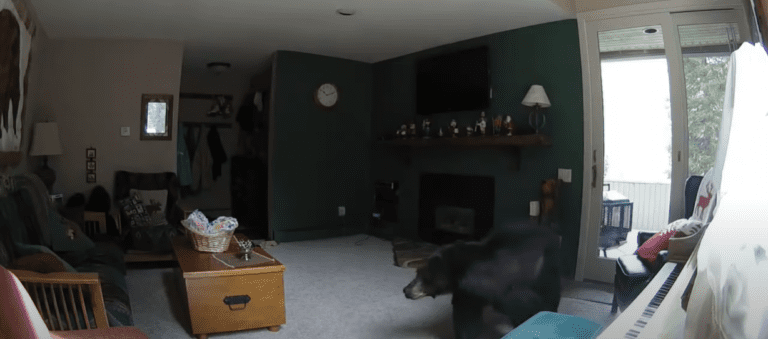
Where is `dark gray wall`? This screenshot has width=768, height=339. dark gray wall is located at coordinates [315, 151], [534, 67].